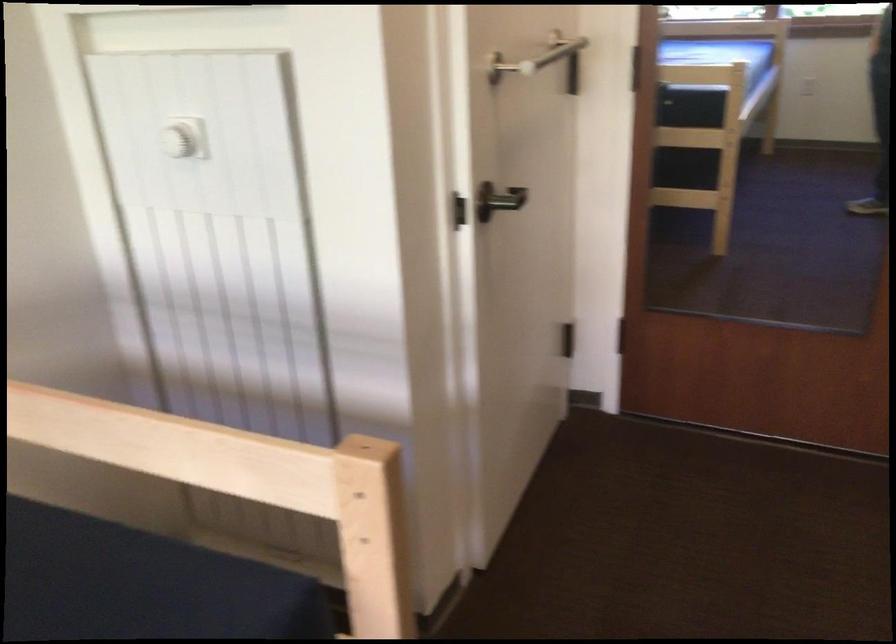
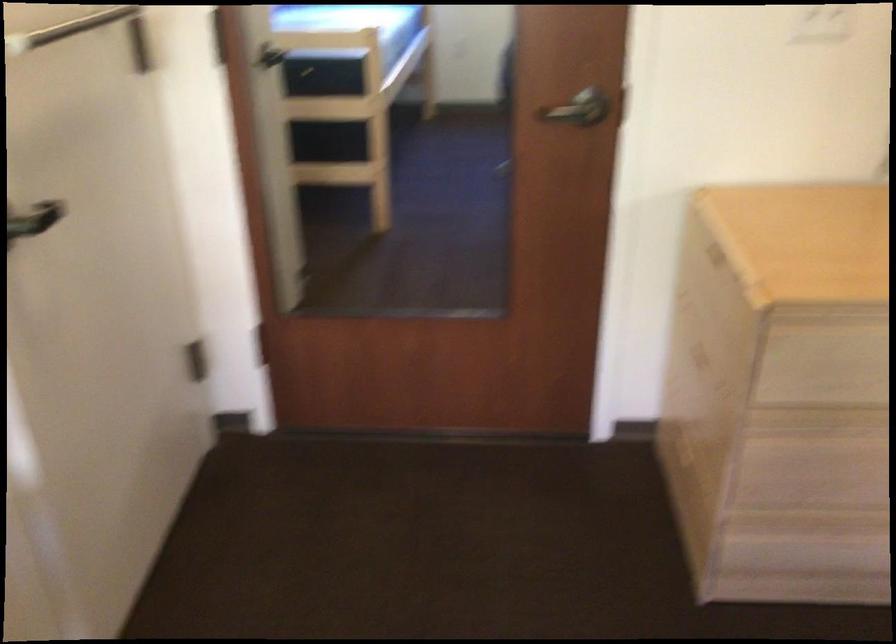
Question: The camera is either moving clockwise (left) or counter-clockwise (right) around the object. The first image is from the beginning of the video and the second image is from the end. Is the camera moving left or right when shooting the video?

Choices:
 (A) Left
 (B) Right

Answer: (A)